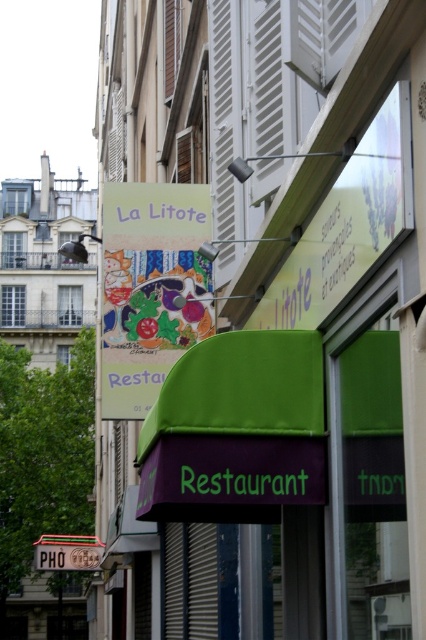
You are a delivery person standing at the entrance of the street. You need to place a large package in front of the restaurant. The package requires a space of 7 meters to be placed. Is there enough space between the matte colorful signboard at center and the metallic silver shutter at center to place the package?

The distance between the matte colorful signboard at center and the metallic silver shutter at center is 6.90 meters, which is slightly less than the required 7 meters. Therefore, there is not enough space to place the package between them.